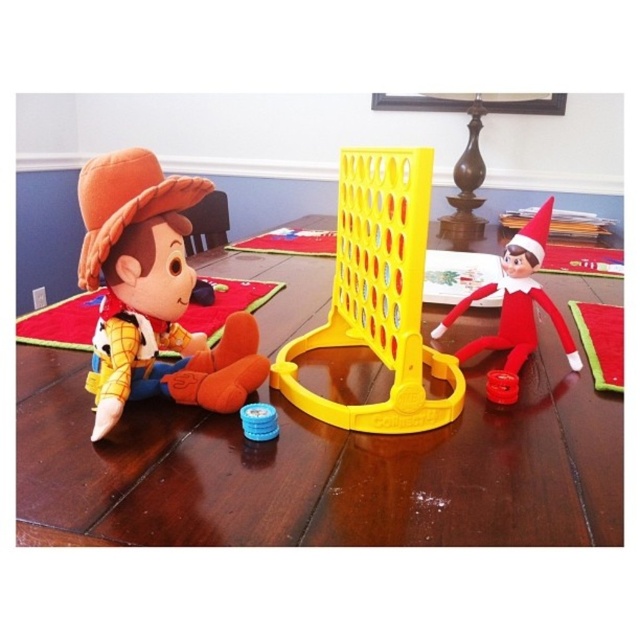
Does point (397, 205) lie in front of point (513, 269)?

That is True.

Does yellow plastic game at center have a greater height compared to satin red elf at right?

Indeed, yellow plastic game at center has a greater height compared to satin red elf at right.

Does point (316, 400) lie behind point (524, 291)?

No.

At what (x,y) coordinates should I click in order to perform the action: click on yellow plastic game at center. Please return your answer as a coordinate pair (x, y). Looking at the image, I should click on (378, 296).

Identify the location of yellow plastic game at center. (378, 296).

Is yellow plastic game at center thinner than blue plastic game piece at center?

No.

I want to click on yellow plastic game at center, so click(x=378, y=296).

Identify the location of yellow plastic game at center. This screenshot has height=640, width=640. (378, 296).

Who is higher up, satin red elf at right or blue plastic game piece at center?

Positioned higher is satin red elf at right.

Which is behind, point (515, 371) or point (252, 417)?

Positioned behind is point (515, 371).

Where is `satin red elf at right`? The width and height of the screenshot is (640, 640). satin red elf at right is located at coordinates (515, 310).